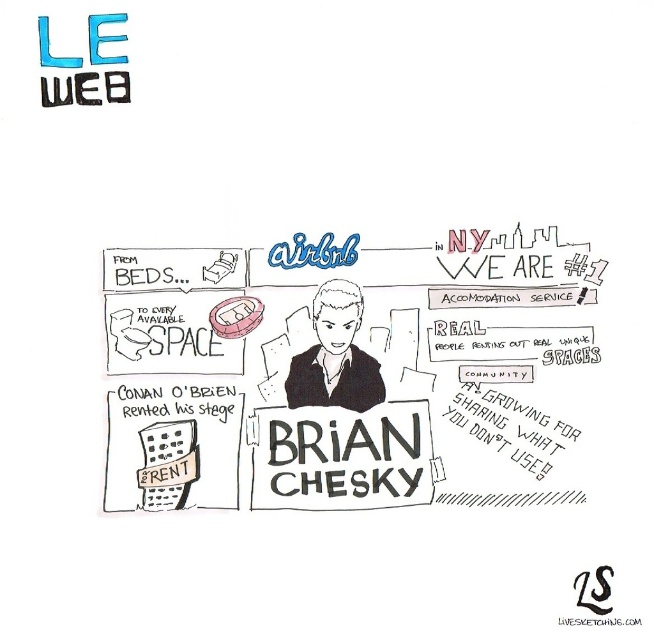
Can you confirm if black paper sign at center is shorter than black matte portrait at center?

Correct, black paper sign at center is not as tall as black matte portrait at center.

Between point (417, 403) and point (328, 342), which one is positioned in front?

Point (417, 403)

Where is `black paper sign at center`? Image resolution: width=654 pixels, height=640 pixels. black paper sign at center is located at coordinates (341, 458).